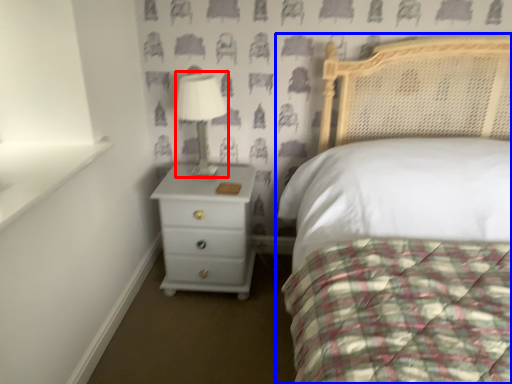
Question: Which of the following is the farthest to the observer, table lamp (highlighted by a red box) or bed (highlighted by a blue box)?

Choices:
 (A) table lamp
 (B) bed

Answer: (A)